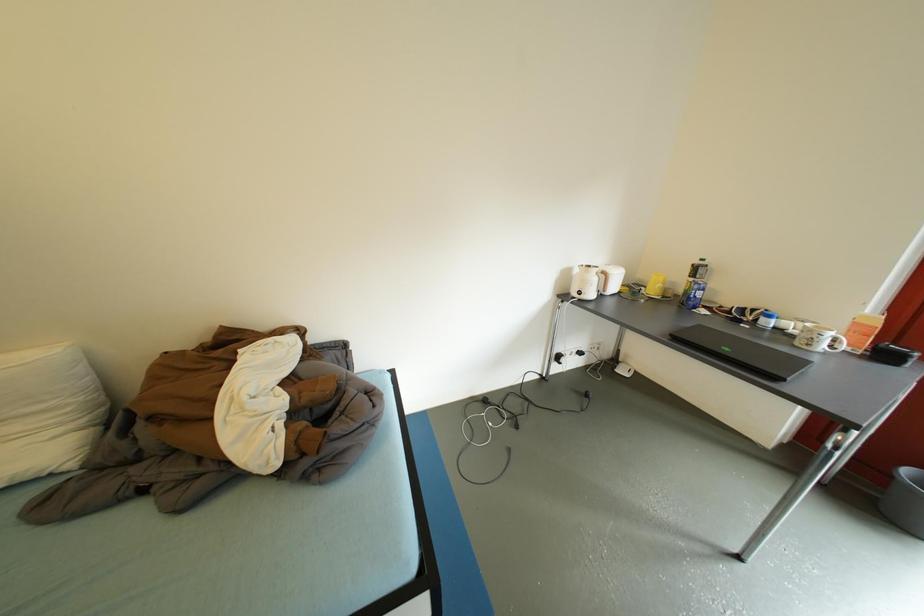
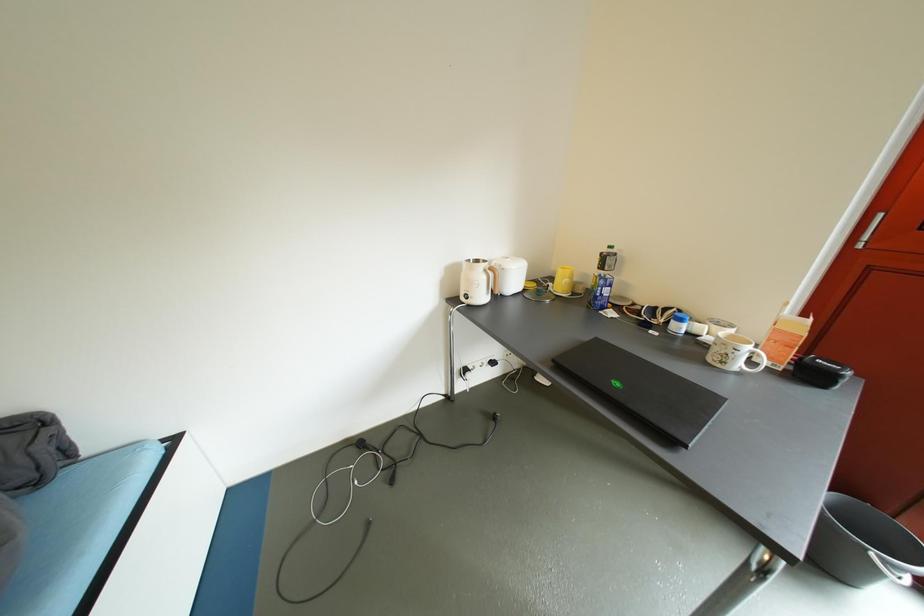
Question: The camera is either moving clockwise (left) or counter-clockwise (right) around the object. The first image is from the beginning of the video and the second image is from the end. Is the camera moving left or right when shooting the video?

Choices:
 (A) Left
 (B) Right

Answer: (A)